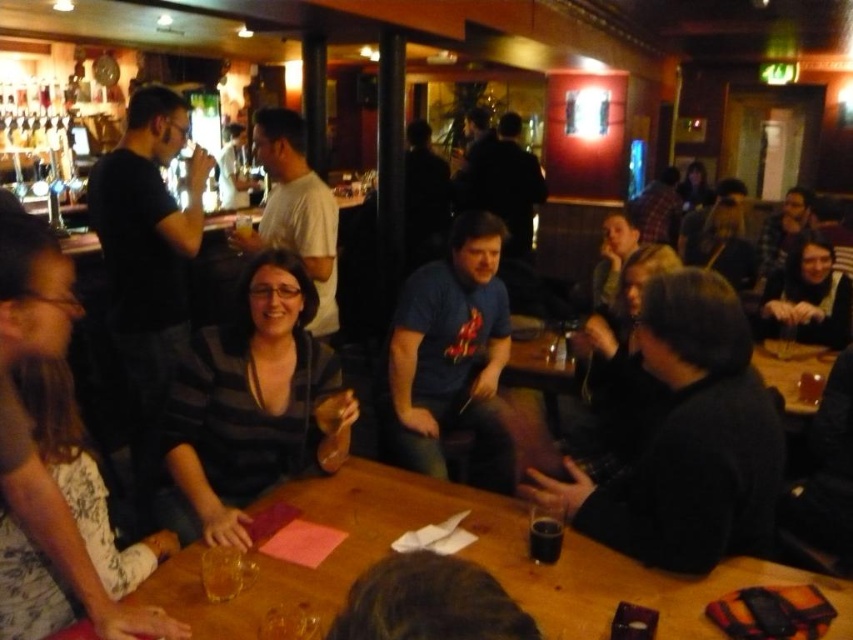
Does striped fabric shirt at center have a lesser width compared to black glass at table center?

No.

Looking at this image, who is more forward, (279, 294) or (553, 518)?

Positioned in front is point (553, 518).

Measure the distance between striped fabric shirt at center and camera.

A distance of 1.63 meters exists between striped fabric shirt at center and camera.

The image size is (853, 640). Identify the location of striped fabric shirt at center. (252, 403).

Who is taller, wooden table at center or black fuzzy jacket at right?

Standing taller between the two is black fuzzy jacket at right.

Between wooden table at center and black fuzzy jacket at right, which one appears on the left side from the viewer's perspective?

wooden table at center is more to the left.

Is point (668, 605) farther from viewer compared to point (749, 369)?

No, (668, 605) is closer to viewer.

At what (x,y) coordinates should I click in order to perform the action: click on wooden table at center. Please return your answer as a coordinate pair (x, y). Looking at the image, I should click on (462, 556).

Is point (143, 582) positioned after point (294, 468)?

No, (143, 582) is closer to viewer.

Identify the location of wooden table at center. The image size is (853, 640). (462, 556).

Find the location of a particular element. This screenshot has width=853, height=640. wooden table at center is located at coordinates (462, 556).